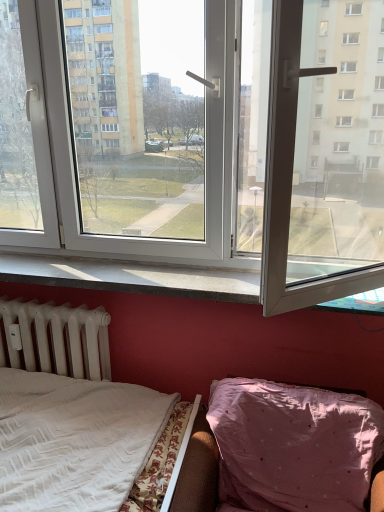
Question: Is white matte radiator at lower left taller than white plastic window at center?

Choices:
 (A) no
 (B) yes

Answer: (A)

Question: Could you tell me if white matte radiator at lower left is turned towards white plastic window at center?

Choices:
 (A) no
 (B) yes

Answer: (A)

Question: Is white matte radiator at lower left to the right of white plastic window at center from the viewer's perspective?

Choices:
 (A) no
 (B) yes

Answer: (A)

Question: Would you say white plastic window at center is part of white matte radiator at lower left's contents?

Choices:
 (A) no
 (B) yes

Answer: (A)

Question: From the image's perspective, would you say white matte radiator at lower left is shown under white plastic window at center?

Choices:
 (A) yes
 (B) no

Answer: (A)

Question: From the image's perspective, relative to pink fabric hospital bed at lower right, is white plastic window at center above or below?

Choices:
 (A) above
 (B) below

Answer: (A)

Question: From a real-world perspective, is white plastic window at center physically located above or below pink fabric hospital bed at lower right?

Choices:
 (A) above
 (B) below

Answer: (A)

Question: Considering the relative positions of white plastic window at center and pink fabric hospital bed at lower right in the image provided, is white plastic window at center to the left or to the right of pink fabric hospital bed at lower right?

Choices:
 (A) right
 (B) left

Answer: (B)

Question: Is white plastic window at center inside or outside of pink fabric hospital bed at lower right?

Choices:
 (A) outside
 (B) inside

Answer: (A)

Question: Based on their sizes in the image, would you say white matte radiator at lower left is bigger or smaller than white glossy window sill at lower center?

Choices:
 (A) big
 (B) small

Answer: (A)

Question: From a real-world perspective, relative to white glossy window sill at lower center, is white matte radiator at lower left vertically above or below?

Choices:
 (A) above
 (B) below

Answer: (B)

Question: Considering the positions of white matte radiator at lower left and white glossy window sill at lower center in the image, is white matte radiator at lower left wider or thinner than white glossy window sill at lower center?

Choices:
 (A) thin
 (B) wide

Answer: (A)

Question: In the image, is white matte radiator at lower left positioned in front of or behind white glossy window sill at lower center?

Choices:
 (A) behind
 (B) front

Answer: (A)

Question: Would you say pink fabric hospital bed at lower right is to the left or to the right of white plastic window at center in the picture?

Choices:
 (A) right
 (B) left

Answer: (A)

Question: Choose the correct answer: Is pink fabric hospital bed at lower right inside white plastic window at center or outside it?

Choices:
 (A) inside
 (B) outside

Answer: (B)